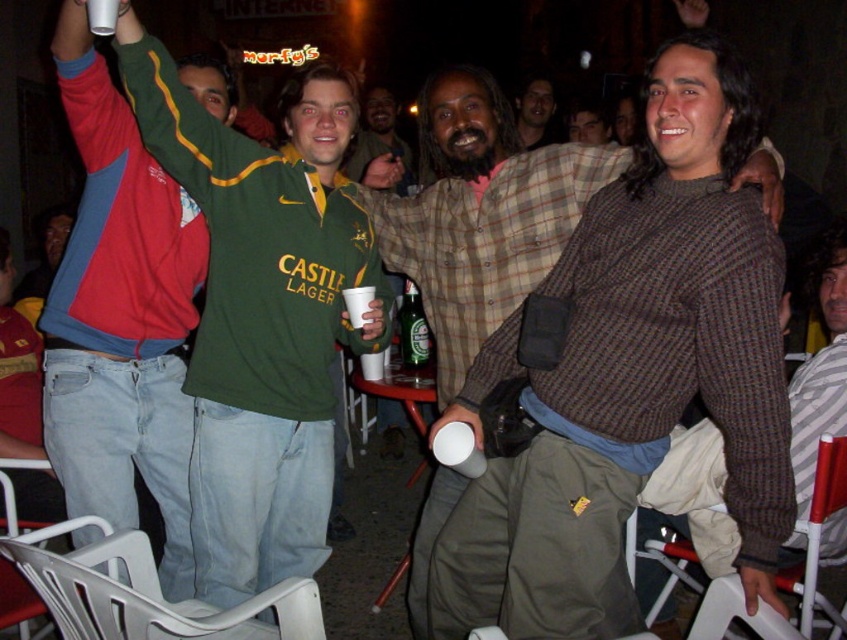
Does matte green shirt at center have a lesser height compared to smooth brown leather jacket at center?

No.

Which is in front, point (397, 140) or point (610, 138)?

Positioned in front is point (397, 140).

Does point (369, 156) lie behind point (596, 118)?

Yes.

This screenshot has height=640, width=847. Find the location of `matte green shirt at center`. matte green shirt at center is located at coordinates (379, 145).

Does brown wool sweater at center come in front of smooth brown leather jacket at center?

Yes, it is in front of smooth brown leather jacket at center.

Measure the distance between point (638, 307) and camera.

Point (638, 307) is 5.72 feet away from camera.

The height and width of the screenshot is (640, 847). I want to click on brown wool sweater at center, so click(630, 371).

Which is above, green jersey at center or red and blue jacket at left?

green jersey at center is higher up.

Is green jersey at center in front of red and blue jacket at left?

No, green jersey at center is behind red and blue jacket at left.

Which is behind, point (214, 202) or point (176, 470)?

Point (176, 470)

Find the location of a particular element. This screenshot has height=640, width=847. green jersey at center is located at coordinates (261, 314).